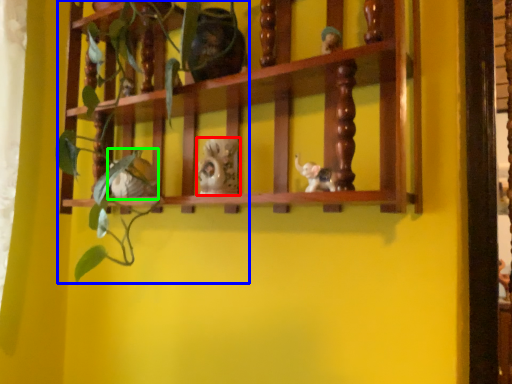
Question: Estimate the real-world distances between objects in this image. Which object is closer to toy (highlighted by a red box), plant (highlighted by a blue box) or toy (highlighted by a green box)?

Choices:
 (A) plant
 (B) toy

Answer: (B)